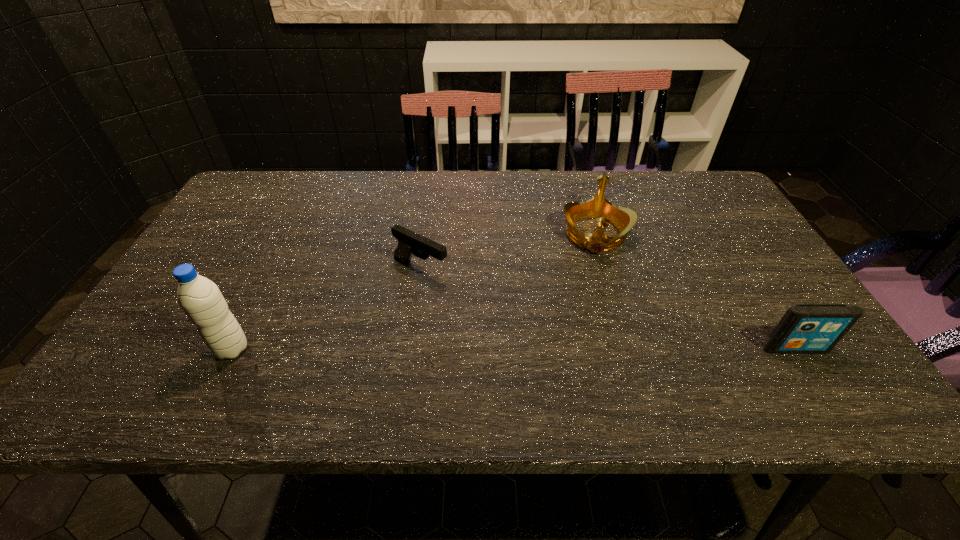
At what (x,y) coordinates should I click in order to perform the action: click on free space between the rightmost object and the tiara. Please return your answer as a coordinate pair (x, y). Looking at the image, I should click on (695, 292).

Identify the location of free space that is in between the water bottle and the pistol. This screenshot has width=960, height=540. (326, 309).

This screenshot has width=960, height=540. In order to click on unoccupied position between the tallest object and the rightmost object in this screenshot , I will do `click(514, 349)`.

Where is `blank region between the second object from right to left and the iPod`? Image resolution: width=960 pixels, height=540 pixels. blank region between the second object from right to left and the iPod is located at coordinates (695, 292).

Locate which object is the second closest to the shortest object. Please provide its 2D coordinates. Your answer should be formatted as a tuple, i.e. [(x, y)], where the tuple contains the x and y coordinates of a point satisfying the conditions above.

[(200, 298)]

The width and height of the screenshot is (960, 540). Find the location of `the closest object relative to the tiara`. the closest object relative to the tiara is located at coordinates (409, 242).

You are a GUI agent. You are given a task and a screenshot of the screen. Output one action in this format:
    pyautogui.click(x=<x>, y=<y>)
    Task: Click on the vacant space that satisfies the following two spatial constraints: 1. on the back side of the shortest object; 2. on the right side of the third object from left to right
    The width and height of the screenshot is (960, 540).
    Given the screenshot: What is the action you would take?
    pyautogui.click(x=425, y=234)

Locate an element on the screen. The height and width of the screenshot is (540, 960). blank area in the image that satisfies the following two spatial constraints: 1. on the back side of the tallest object; 2. on the left side of the pistol is located at coordinates (272, 270).